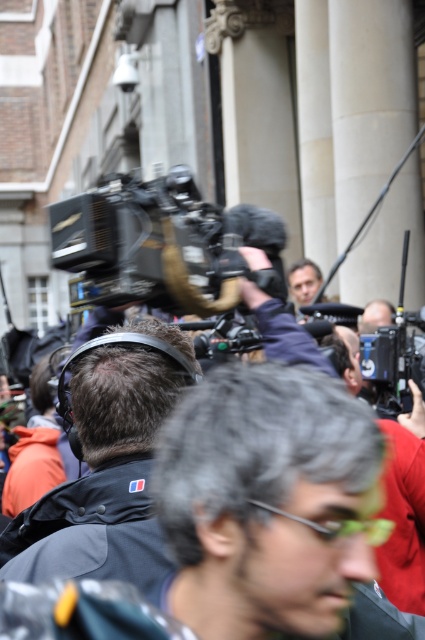
Looking at this image, you are a technician at the event and need to adjust the equipment. Which camera is on the left side between the black plastic video camera at center and the matte black camera at center?

The black plastic video camera at center is positioned on the left side of matte black camera at center, so the black plastic video camera at center is on the left.

You are a photographer at the event and need to adjust your camera settings based on the distance of objects. Which object is nearer to you between the black plastic video camera at center and the dark gray fabric headphones at center?

The black plastic video camera at center is closer to the viewer than the dark gray fabric headphones at center, so the black plastic video camera at center is nearer.

You are a technician at the event and need to place both the black plastic video camera at center and the dark gray fabric headphones at center into a storage box. The box can only fit items up to the width of the camera. Will the headphones fit?

The black plastic video camera at center is wider than the dark gray fabric headphones at center, so the headphones will fit into the storage box since their width is less than the camera.